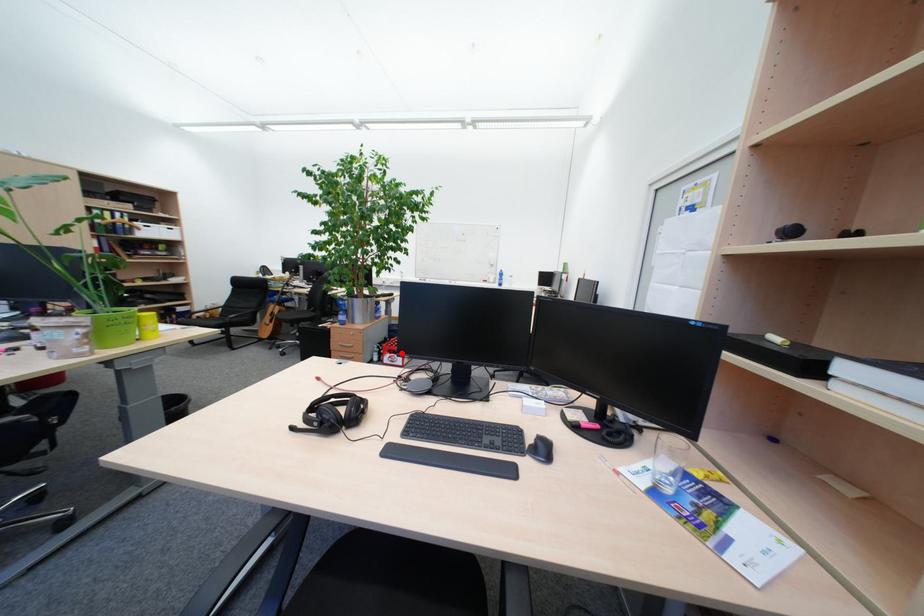
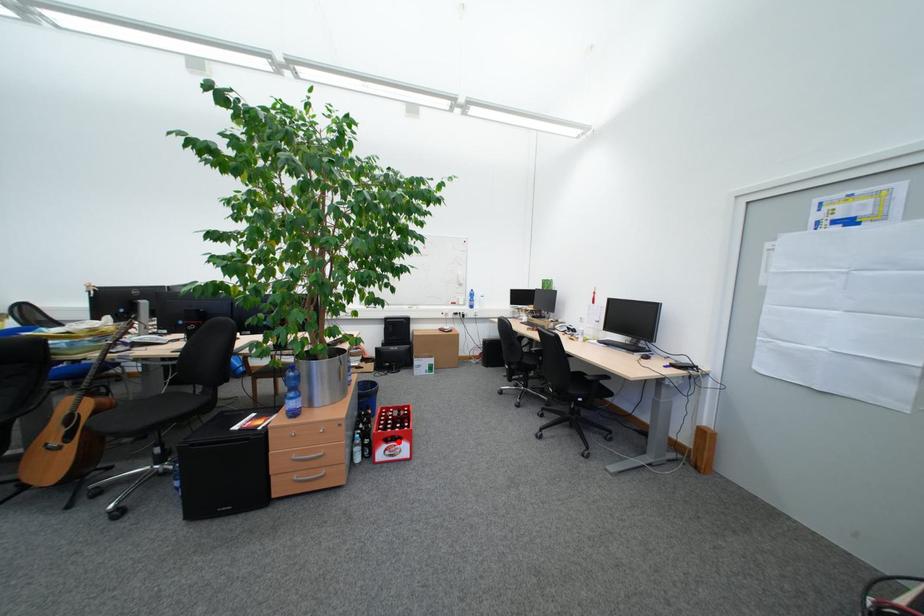
I am providing you with two images of the same scene from different viewpoints. A red point is marked on the first image and another point is marked on the second image. Is the marked point in image1 the same physical position as the marked point in image2?

Yes